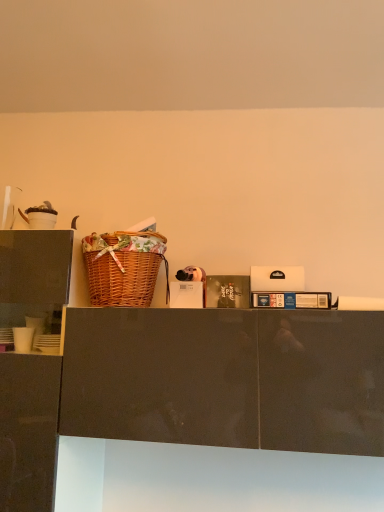
At what (x,y) coordinates should I click in order to perform the action: click on woven brown picnic basket at center. Please return your answer as a coordinate pair (x, y). The width and height of the screenshot is (384, 512). Looking at the image, I should click on (123, 268).

The image size is (384, 512). Describe the element at coordinates (123, 268) in the screenshot. I see `woven brown picnic basket at center` at that location.

What is the approximate height of woven brown picnic basket at center?

woven brown picnic basket at center is 12.25 inches in height.

The image size is (384, 512). Identify the location of woven brown picnic basket at center. (123, 268).